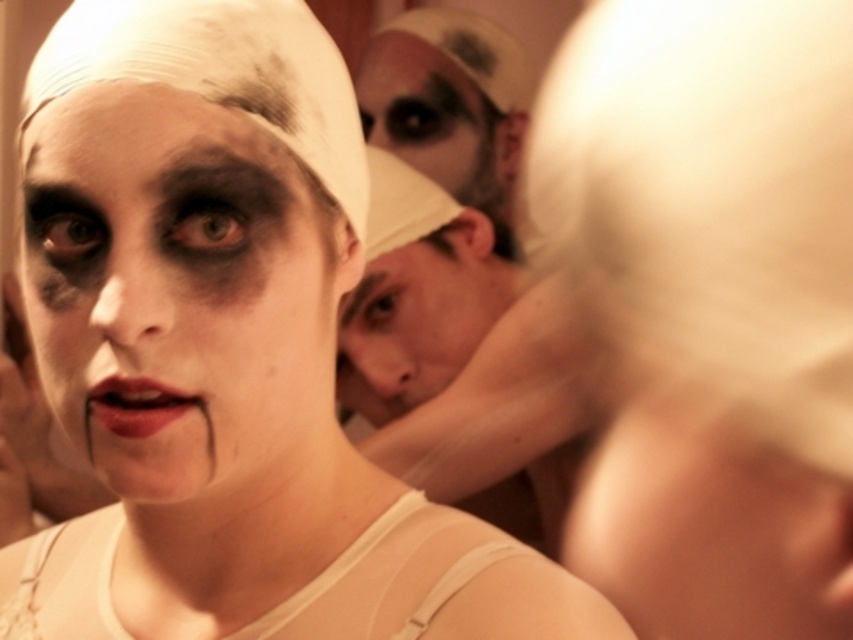
Question: Estimate the real-world distances between objects in this image. Which object is closer to the black matte eyebrow at upper center?

Choices:
 (A) smooth beige cap at center
 (B) white matte face at center
 (C) matte red lipstick at center

Answer: (A)

Question: Is matte white face at upper center positioned behind matte red lipstick at center?

Choices:
 (A) no
 (B) yes

Answer: (B)

Question: Which is nearer to the smooth beige cap at center?

Choices:
 (A) matte red lipstick at center
 (B) matte white face at upper center
 (C) white matte forehead at upper center
 (D) white matte face at center

Answer: (B)

Question: Which object is positioned farthest from the matte white face at upper center?

Choices:
 (A) smooth beige cap at center
 (B) matte red lipstick at center

Answer: (B)

Question: Can you confirm if matte red lipstick at center is thinner than white matte forehead at center?

Choices:
 (A) yes
 (B) no

Answer: (A)

Question: From the image, what is the correct spatial relationship of smooth skin face at center in relation to white matte forehead at upper center?

Choices:
 (A) below
 (B) above

Answer: (A)